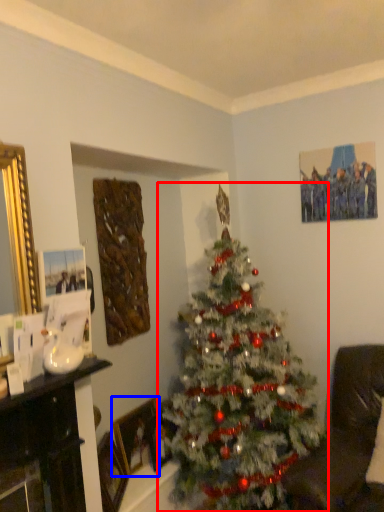
Question: Which object is further to the camera taking this photo, christmas tree (highlighted by a red box) or picture frame (highlighted by a blue box)?

Choices:
 (A) christmas tree
 (B) picture frame

Answer: (B)